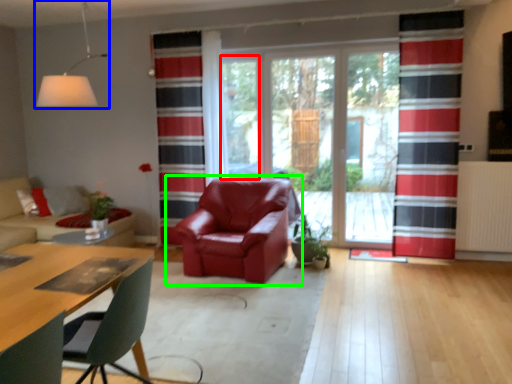
Question: Which is nearer to the window screen (highlighted by a red box)? light fixture (highlighted by a blue box) or chair (highlighted by a green box).

Choices:
 (A) light fixture
 (B) chair

Answer: (B)